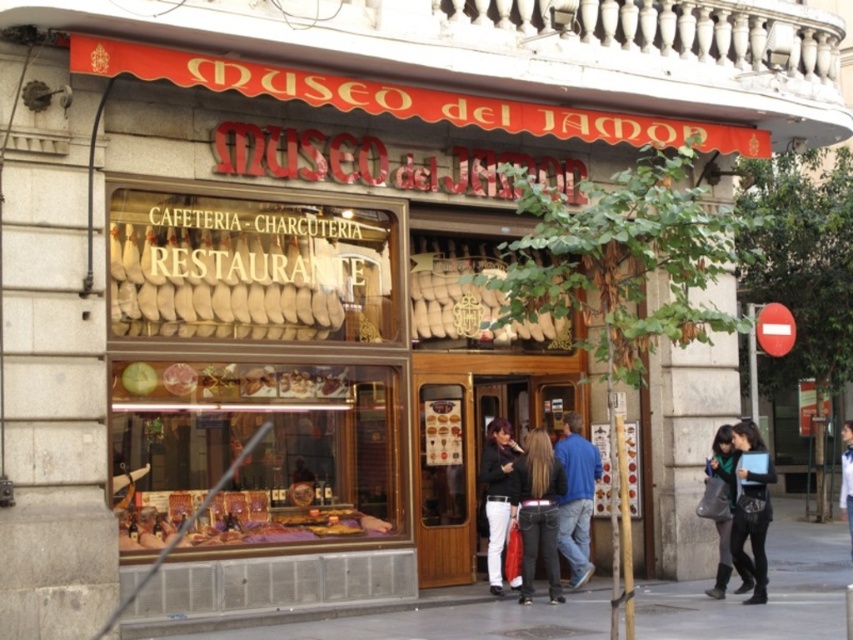
Question: Which point is farther to the camera?

Choices:
 (A) light blue denim jacket at lower right
 (B) black leather jacket at lower right

Answer: (A)

Question: Which object appears closest to the camera in this image?

Choices:
 (A) black leather jacket at lower right
 (B) dark blue fabric jacket at lower right

Answer: (A)

Question: Is smooth concrete pavement at lower center positioned in front of shiny purple cloth at center?

Choices:
 (A) yes
 (B) no

Answer: (A)

Question: Is the position of shiny purple cloth at center less distant than that of matte black jacket at center?

Choices:
 (A) no
 (B) yes

Answer: (B)

Question: Does smooth concrete pavement at lower center have a lesser width compared to shiny purple cloth at center?

Choices:
 (A) yes
 (B) no

Answer: (B)

Question: Which point is farther to the camera?

Choices:
 (A) shiny purple cloth at center
 (B) black leather jacket at center

Answer: (B)